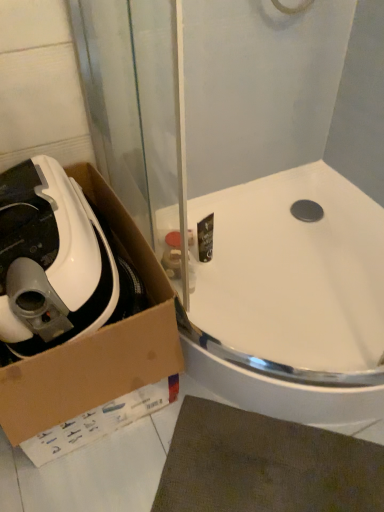
Question: Considering their positions, is cardboard box at lower left located in front of or behind white matte vacuum cleaner at left?

Choices:
 (A) front
 (B) behind

Answer: (A)

Question: Based on their positions, is cardboard box at lower left located to the left or right of white matte vacuum cleaner at left?

Choices:
 (A) left
 (B) right

Answer: (B)

Question: Which object is positioned closest to the white matte vacuum cleaner at left?

Choices:
 (A) cardboard box at lower left
 (B) white glossy sink at upper center

Answer: (A)

Question: Based on their relative distances, which object is nearer to the white matte vacuum cleaner at left?

Choices:
 (A) cardboard box at lower left
 (B) white glossy sink at upper center

Answer: (A)